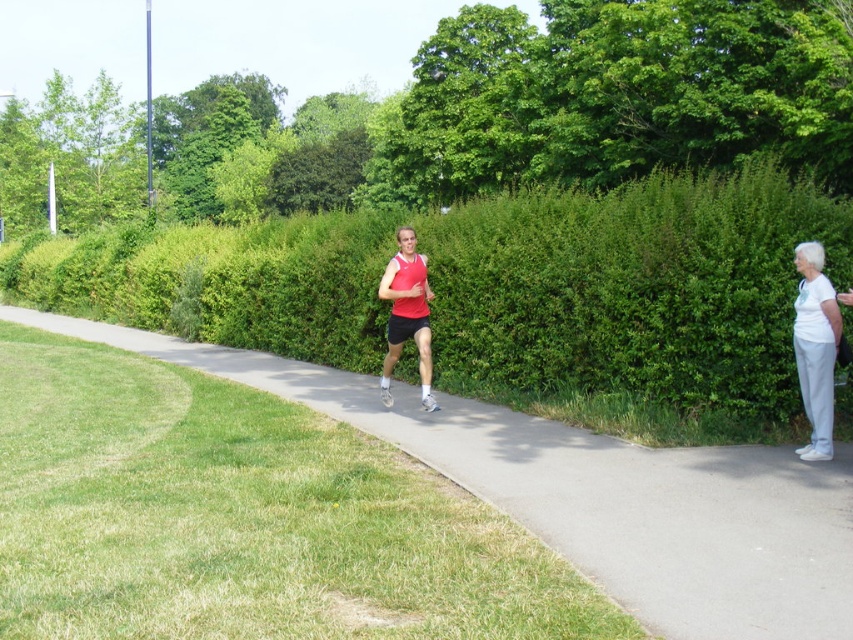
You are a pedestrian walking along the path and want to step onto the gray asphalt pavement at center. Which direction should you move relative to the matte red tank top at center?

The gray asphalt pavement at center is to the right of the matte red tank top at center, so you should move to the right relative to the matte red tank top at center to step onto it.

You are a drone operator trying to capture aerial footage of the jogging path. You notice the green leafy hedge at center and the gray asphalt pavement at center. Which object is taller and might block the drone camera lens?

The green leafy hedge at center is taller than the gray asphalt pavement at center, so it might block the drone camera lens.